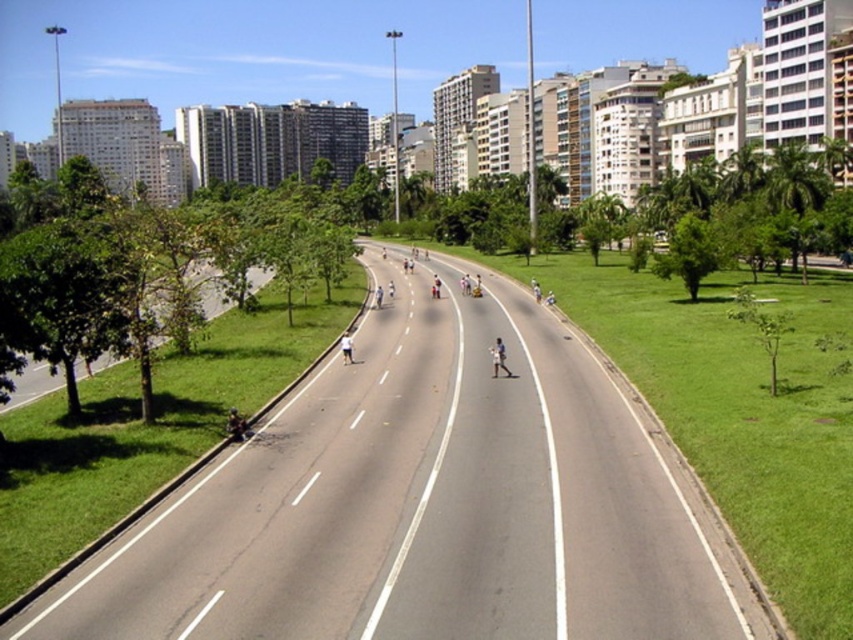
Measure the distance between smooth asphalt road at center and white matte person at center.

smooth asphalt road at center and white matte person at center are 6.44 meters apart.

Is smooth asphalt road at center to the right of white matte person at center from the viewer's perspective?

Incorrect, smooth asphalt road at center is not on the right side of white matte person at center.

At what (x,y) coordinates should I click in order to perform the action: click on smooth asphalt road at center. Please return your answer as a coordinate pair (x, y). Looking at the image, I should click on (427, 500).

Find the location of a particular element. smooth asphalt road at center is located at coordinates (427, 500).

Who is shorter, smooth asphalt road at center or dark green fabric at center?

Standing shorter between the two is dark green fabric at center.

Based on the photo, between smooth asphalt road at center and dark green fabric at center, which one is positioned lower?

Positioned lower is dark green fabric at center.

Between point (97, 632) and point (233, 412), which one is positioned behind?

Positioned behind is point (233, 412).

This screenshot has width=853, height=640. I want to click on smooth asphalt road at center, so click(x=427, y=500).

Who is lower down, dark green fabric at center or white matte person at center?

dark green fabric at center is lower down.

Is dark green fabric at center bigger than white matte person at center?

No, dark green fabric at center is not bigger than white matte person at center.

Who is more forward, (231, 406) or (492, 353)?

Positioned in front is point (231, 406).

You are a GUI agent. You are given a task and a screenshot of the screen. Output one action in this format:
    pyautogui.click(x=<x>, y=<y>)
    Task: Click on the dark green fabric at center
    
    Given the screenshot: What is the action you would take?
    pyautogui.click(x=236, y=426)